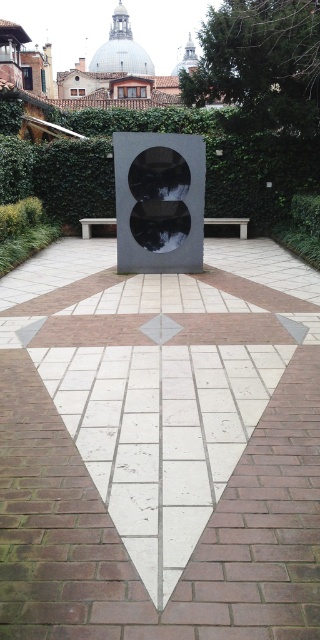
Measure the distance between point [54,314] and camera.

Point [54,314] and camera are 21.53 feet apart.

Find the location of a particular element. This screenshot has height=640, width=320. white brick path at center is located at coordinates (160, 448).

Is point (24, 275) behind point (103, 221)?

No, (24, 275) is in front of (103, 221).

Can you confirm if white brick path at center is positioned to the left of smooth gray bench at center?

No, white brick path at center is not to the left of smooth gray bench at center.

Find the location of `white brick path at center`. white brick path at center is located at coordinates (160, 448).

This screenshot has height=640, width=320. Find the location of `white brick path at center`. white brick path at center is located at coordinates (160, 448).

Is wooden bench at center smaller than light gray wooden bench at center?

Indeed, wooden bench at center has a smaller size compared to light gray wooden bench at center.

Does wooden bench at center appear over light gray wooden bench at center?

Yes.

Locate an element on the screen. wooden bench at center is located at coordinates (230, 224).